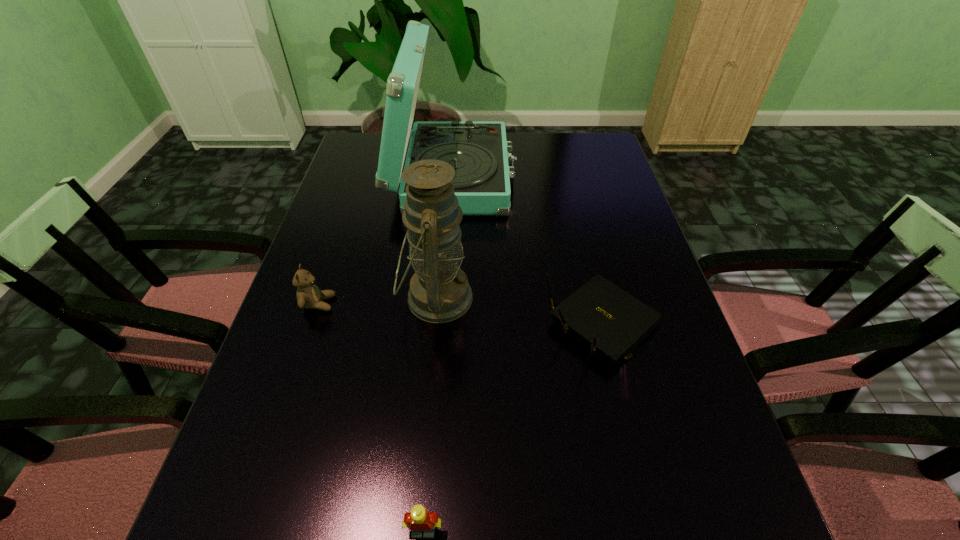
You are a GUI agent. You are given a task and a screenshot of the screen. Output one action in this format:
    pyautogui.click(x=<x>, y=<y>)
    Task: Click on the object that is at the near edge
    This screenshot has height=540, width=960.
    Given the screenshot: What is the action you would take?
    pyautogui.click(x=419, y=521)

I want to click on record player that is positioned at the left edge, so click(x=478, y=151).

You are a GUI agent. You are given a task and a screenshot of the screen. Output one action in this format:
    pyautogui.click(x=<x>, y=<y>)
    Task: Click on the teddy bear present at the left edge
    Image resolution: width=960 pixels, height=540 pixels.
    Given the screenshot: What is the action you would take?
    pyautogui.click(x=309, y=296)

Locate an element on the screen. The width and height of the screenshot is (960, 540). object that is at the right edge is located at coordinates (613, 321).

The width and height of the screenshot is (960, 540). Find the location of `object that is at the far left corner`. object that is at the far left corner is located at coordinates (478, 151).

In the image, there is a desktop. At what (x,y) coordinates should I click in order to perform the action: click on vacant region at the left edge. Please return your answer as a coordinate pair (x, y). The height and width of the screenshot is (540, 960). Looking at the image, I should click on (374, 173).

The width and height of the screenshot is (960, 540). Find the location of `vacant space at the right edge`. vacant space at the right edge is located at coordinates (753, 514).

At what (x,y) coordinates should I click in order to perform the action: click on vacant space at the far left corner of the desktop. Please return your answer as a coordinate pair (x, y). Looking at the image, I should click on (357, 154).

The height and width of the screenshot is (540, 960). Identify the location of vacant space at the far right corner of the desktop. (600, 148).

You are a GUI agent. You are given a task and a screenshot of the screen. Output one action in this format:
    pyautogui.click(x=<x>, y=<y>)
    Task: Click on the free space between the router and the oil lamp
    
    Given the screenshot: What is the action you would take?
    pyautogui.click(x=520, y=310)